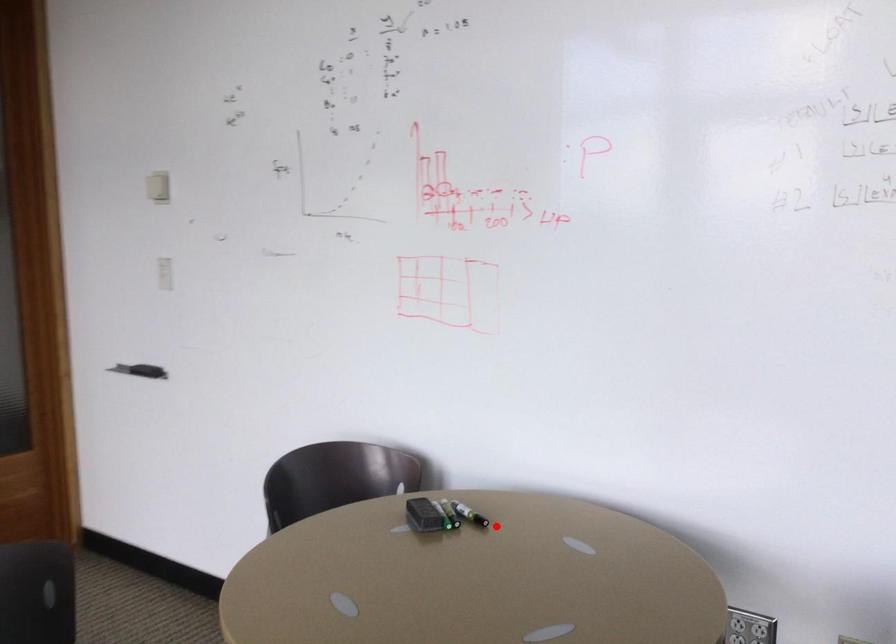
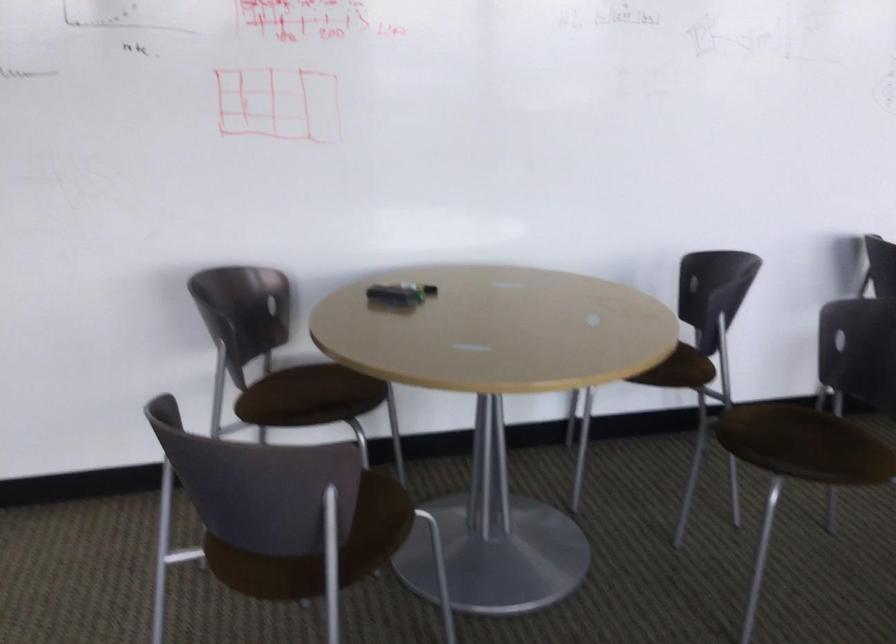
Question: A red point is marked in image1. In image2, is the corresponding 3D point closer to the camera or farther? Reply with the corresponding letter.

Choices:
 (A) The corresponding 3D point is closer.
 (B) The corresponding 3D point is farther.

Answer: (B)